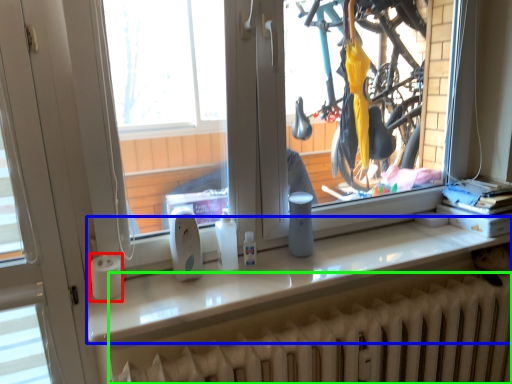
Question: Estimate the real-world distances between objects in this image. Which object is closer to paper towel (highlighted by a red box), counter top (highlighted by a blue box) or radiator (highlighted by a green box)?

Choices:
 (A) counter top
 (B) radiator

Answer: (A)